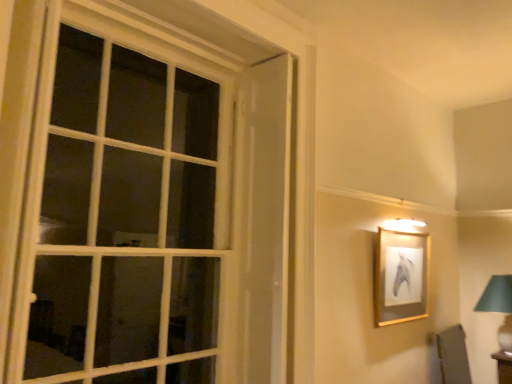
Question: Is green fabric lampshade at right taller or shorter than gold/glossy picture frame at upper right?

Choices:
 (A) tall
 (B) short

Answer: (B)

Question: Is green fabric lampshade at right spatially inside gold/glossy picture frame at upper right, or outside of it?

Choices:
 (A) outside
 (B) inside

Answer: (A)

Question: Which object is positioned closest to the white glass window at left?

Choices:
 (A) gold/glossy picture frame at upper right
 (B) green fabric lampshade at right

Answer: (A)

Question: Which is nearer to the green fabric lampshade at right?

Choices:
 (A) gold/glossy picture frame at upper right
 (B) white glass window at left

Answer: (A)